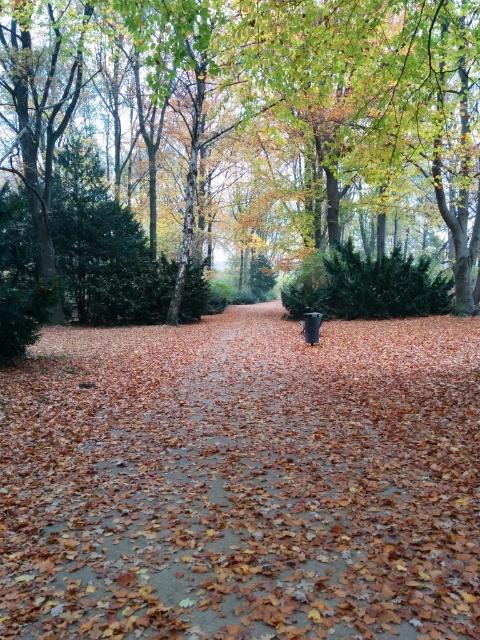
Question: Can you confirm if brown leafy path at center is thinner than green leafy tree at center?

Choices:
 (A) yes
 (B) no

Answer: (A)

Question: In this image, where is brown leafy path at center located relative to green leafy tree at center?

Choices:
 (A) above
 (B) below

Answer: (B)

Question: In this image, where is brown leafy path at center located relative to green leafy tree at center?

Choices:
 (A) below
 (B) above

Answer: (A)

Question: Among these points, which one is nearest to the camera?

Choices:
 (A) (61, 35)
 (B) (194, 563)

Answer: (B)

Question: Among these objects, which one is farthest from the camera?

Choices:
 (A) green leafy tree at center
 (B) brown leafy path at center

Answer: (A)